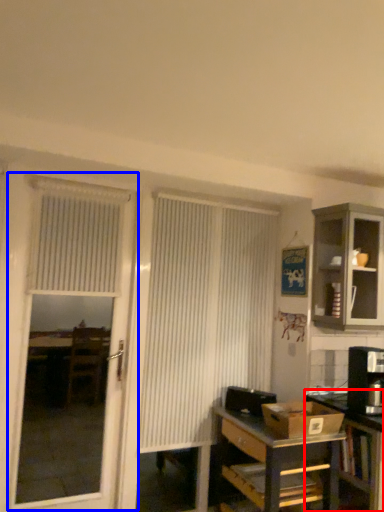
Question: Which object appears closest to the camera in this image, table (highlighted by a red box) or screen door (highlighted by a blue box)?

Choices:
 (A) table
 (B) screen door

Answer: (A)